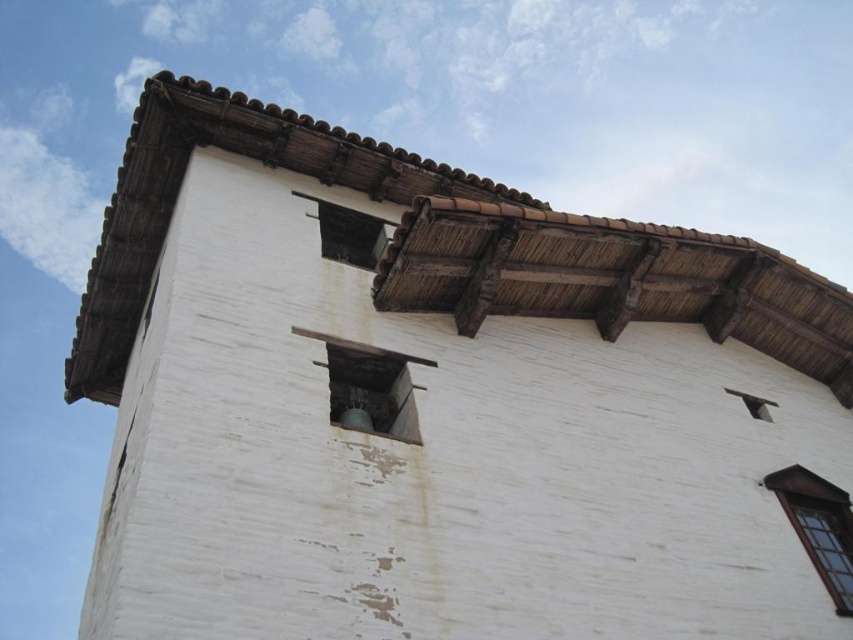
Between point (788, 486) and point (154, 294), which one is positioned behind?

The point (154, 294) is more distant.

Is dark wood window at upper right to the left of transparent glass window at upper left from the viewer's perspective?

In fact, dark wood window at upper right is to the right of transparent glass window at upper left.

This screenshot has width=853, height=640. Identify the location of dark wood window at upper right. (819, 525).

Who is positioned more to the left, dark wood window at upper right or wooden window at upper center?

From the viewer's perspective, wooden window at upper center appears more on the left side.

Which of these two, dark wood window at upper right or wooden window at upper center, stands shorter?

wooden window at upper center is shorter.

Is point (822, 483) positioned behind point (344, 216)?

No.

The height and width of the screenshot is (640, 853). I want to click on dark wood window at upper right, so click(x=819, y=525).

Find the location of `wooden window at upper center`. wooden window at upper center is located at coordinates (347, 234).

Between wooden window at upper center and transparent glass window at upper left, which one has less height?

wooden window at upper center

Measure the distance between point (352, 216) and camera.

Point (352, 216) is 48.59 meters away from camera.

Find the location of a particular element. wooden window at upper center is located at coordinates (347, 234).